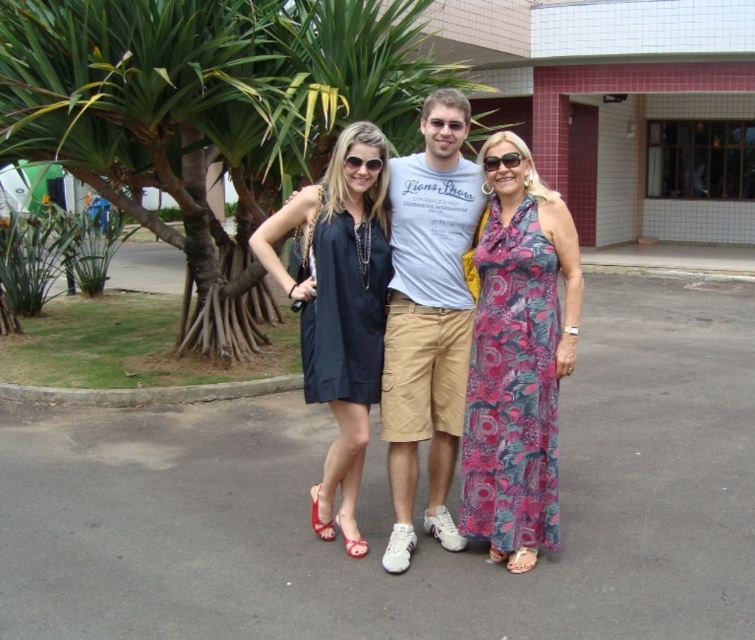
Question: Can you confirm if light gray cotton t-shirt at center is bigger than satin black dress at center?

Choices:
 (A) no
 (B) yes

Answer: (A)

Question: Is light gray cotton t-shirt at center closer to the viewer compared to satin black dress at center?

Choices:
 (A) no
 (B) yes

Answer: (A)

Question: Among these points, which one is nearest to the camera?

Choices:
 (A) (350, 337)
 (B) (529, 419)
 (C) (356, 353)
 (D) (433, 416)

Answer: (B)

Question: Which object is the farthest from the floral print fabric dress at center?

Choices:
 (A) matte black dress at center
 (B) satin black dress at center
 (C) light gray cotton t-shirt at center

Answer: (B)

Question: Can you confirm if green leafy palm tree at center is positioned to the right of satin black dress at center?

Choices:
 (A) no
 (B) yes

Answer: (A)

Question: Which of these objects is positioned farthest from the green leafy palm tree at center?

Choices:
 (A) satin black dress at center
 (B) light gray cotton t-shirt at center

Answer: (B)